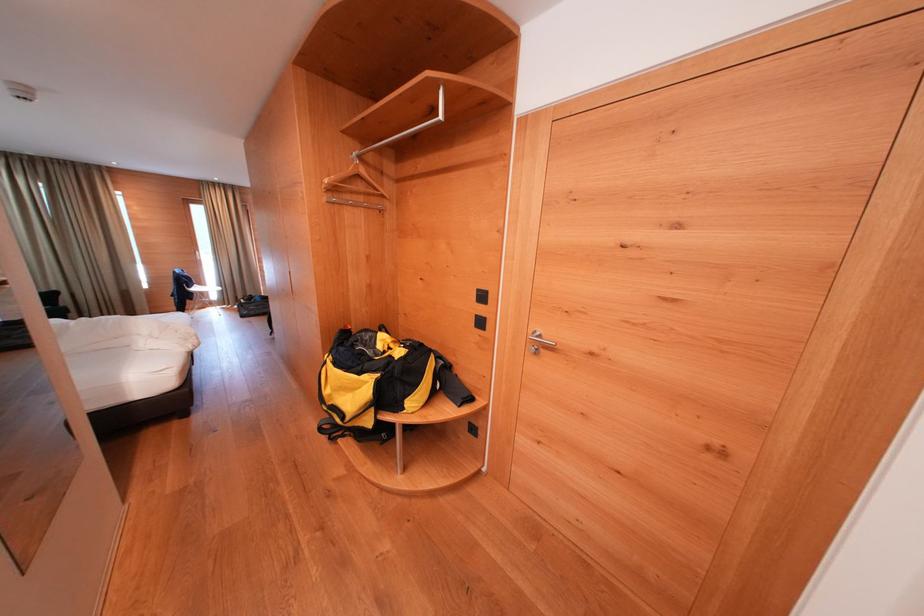
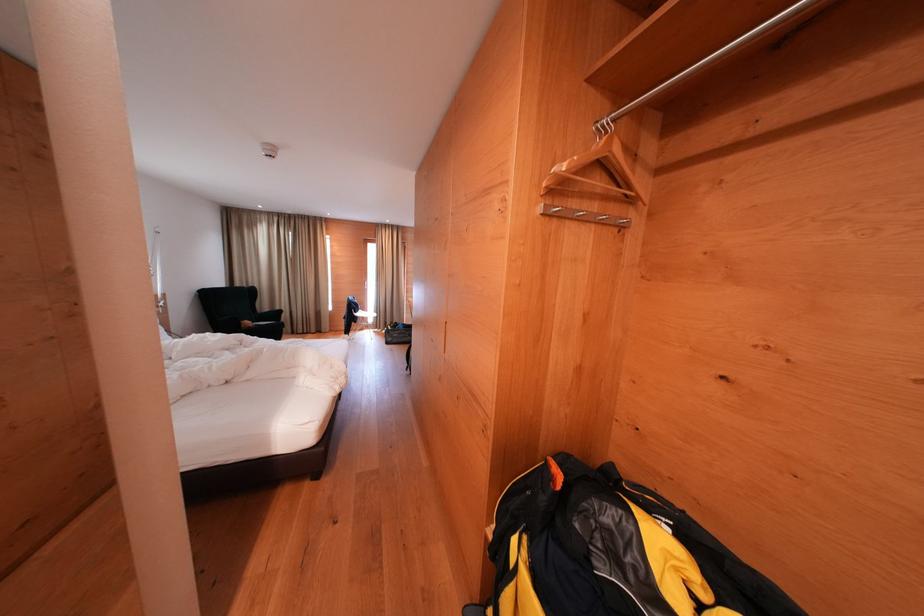
In a continuous first-person perspective shot, in which direction is the camera moving?

The cameraman walked toward left, forward.